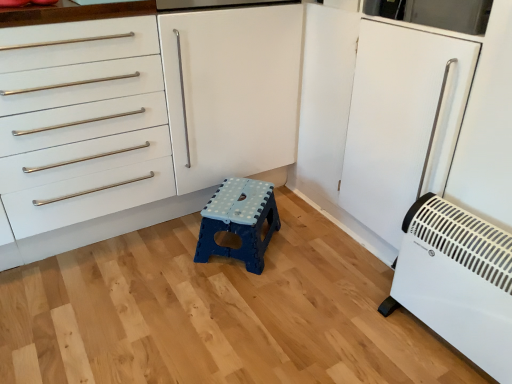
Locate an element on the screen. The width and height of the screenshot is (512, 384). free space between white plastic heater at lower right and blue plastic stool at center is located at coordinates (325, 294).